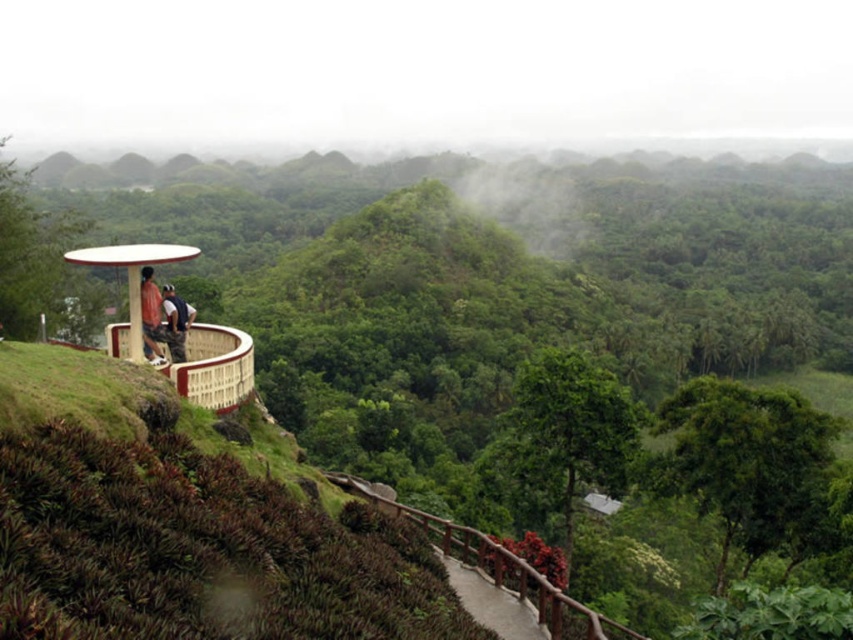
Which is below, concrete wooden railing at lower center or matte red shirt at center?

Positioned lower is concrete wooden railing at lower center.

Is concrete wooden railing at lower center below matte red shirt at center?

Yes, concrete wooden railing at lower center is below matte red shirt at center.

What do you see at coordinates (492, 602) in the screenshot? The width and height of the screenshot is (853, 640). I see `concrete wooden railing at lower center` at bounding box center [492, 602].

Locate an element on the screen. concrete wooden railing at lower center is located at coordinates (492, 602).

Can you confirm if concrete wooden railing at lower center is smaller than dark blue shirt at upper center?

No.

Who is positioned more to the right, concrete wooden railing at lower center or dark blue shirt at upper center?

From the viewer's perspective, concrete wooden railing at lower center appears more on the right side.

The height and width of the screenshot is (640, 853). In order to click on concrete wooden railing at lower center in this screenshot , I will do `click(492, 602)`.

Identify the location of concrete wooden railing at lower center. This screenshot has width=853, height=640. (492, 602).

Which is in front, point (180, 333) or point (157, 353)?

Point (157, 353)

Between dark blue shirt at upper center and matte red shirt at center, which one is positioned lower?

Positioned lower is matte red shirt at center.

Locate an element on the screen. Image resolution: width=853 pixels, height=640 pixels. dark blue shirt at upper center is located at coordinates (175, 323).

The width and height of the screenshot is (853, 640). What are the coordinates of `dark blue shirt at upper center` in the screenshot? It's located at (175, 323).